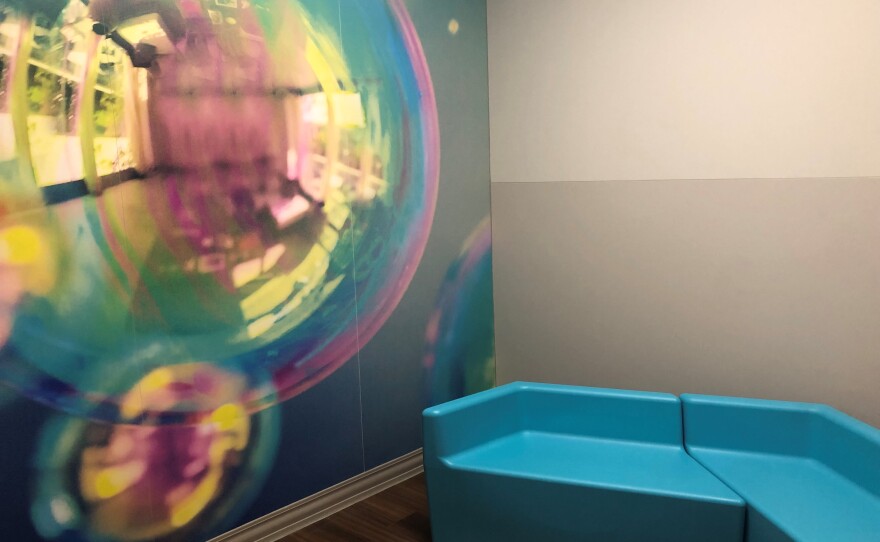
You are a GUI agent. You are given a task and a screenshot of the screen. Output one action in this format:
    pyautogui.click(x=<x>, y=<y>)
    Task: Click on the walls
    This screenshot has height=542, width=880.
    Given the screenshot: What is the action you would take?
    tap(627, 243), tap(269, 298)